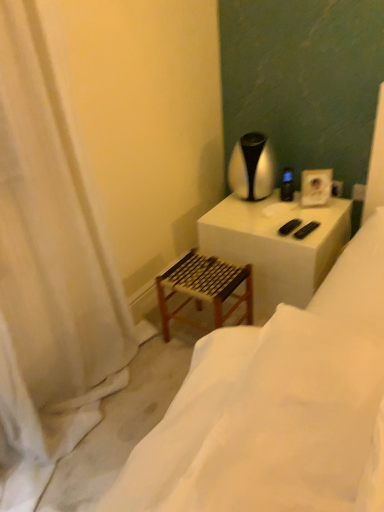
Question: Is point (203, 430) closer or farther from the camera than point (221, 315)?

Choices:
 (A) farther
 (B) closer

Answer: (B)

Question: From the image's perspective, is wooden stool at lower left located above or below wooden woven step stool at lower left?

Choices:
 (A) below
 (B) above

Answer: (A)

Question: Based on their relative distances, which object is farther from the black plastic remote control at upper right?

Choices:
 (A) wooden stool at lower left
 (B) silver metallic table lamp at upper right
 (C) white fabric curtain at left
 (D) wooden woven step stool at lower left
 (E) white matte table at upper right

Answer: (A)

Question: Estimate the real-world distances between objects in this image. Which object is farther from the white matte table at upper right?

Choices:
 (A) silver metallic table lamp at upper right
 (B) wooden woven step stool at lower left
 (C) black plastic remote control at upper right
 (D) white fabric curtain at left
 (E) wooden stool at lower left

Answer: (D)